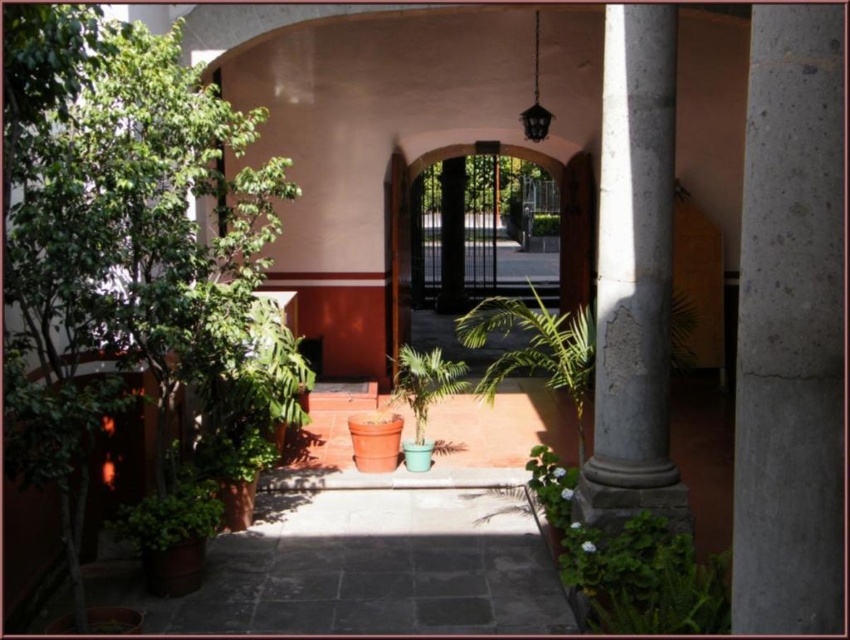
You are standing at the entrance of the corridor and want to walk straight ahead. Which object, the gray concrete pillar at center or the green leafy plant at center, would you encounter first?

The gray concrete pillar at center is in front of the green leafy plant at center, so you would encounter the gray concrete pillar at center first.

In the scene shown: You are a painter who needs to decide whether to place a 3m wide canvas between the gray concrete pillar at center and the brown wooden gate at center. Based on the scene, can the canvas fit between them?

The gray concrete pillar at center has a lesser width compared to brown wooden gate at center. Since the pillar is narrower, the space between them might accommodate the 3m wide canvas, but the exact distance isn needed to confirm.

You are standing at the entrance of the corridor and want to know which object, the smooth concrete pillar at center or the brown wooden gate at center, reaches higher up into the sky. Based on the scene, can you determine which one is taller?

The smooth concrete pillar at center is much taller than the brown wooden gate at center, so the smooth concrete pillar at center reaches higher into the sky.